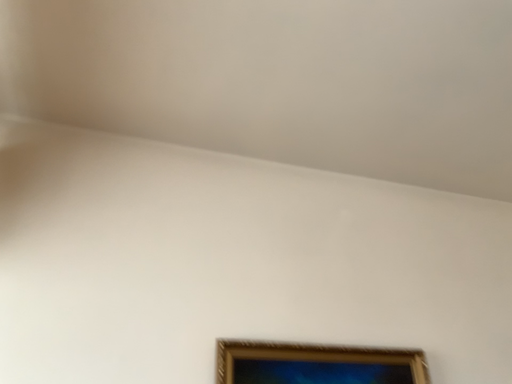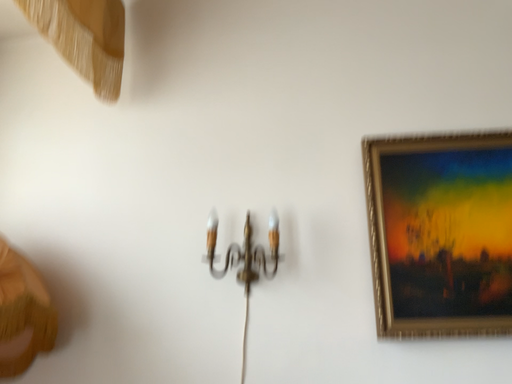
Question: How did the camera likely rotate when shooting the video?

Choices:
 (A) rotated downward
 (B) rotated upward

Answer: (A)